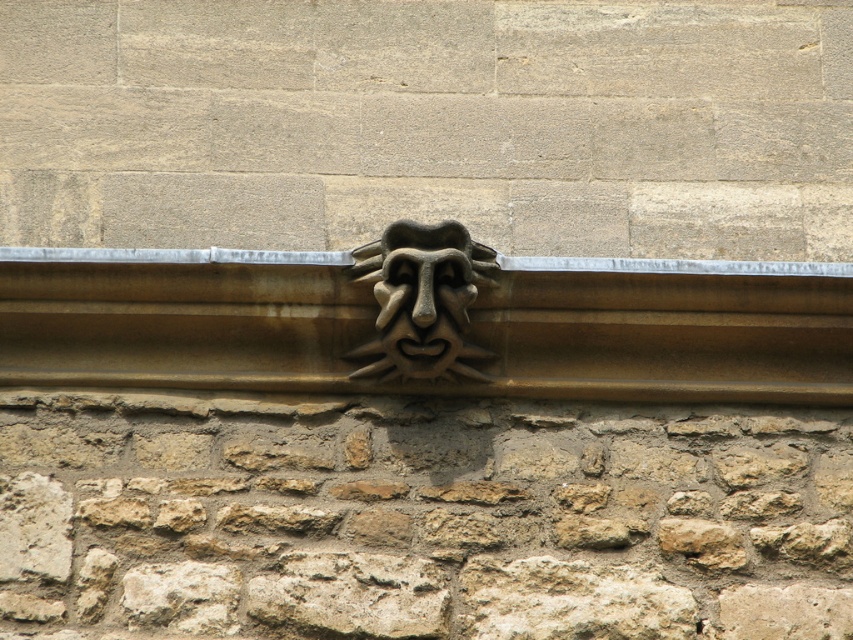
Which of these two, brown rough stone at center or brown stone ledge at center, stands taller?

With more height is brown rough stone at center.

Is brown rough stone at center bigger than brown stone ledge at center?

Correct, brown rough stone at center is larger in size than brown stone ledge at center.

Between point (685, 628) and point (664, 285), which one is positioned in front?

Positioned in front is point (685, 628).

The image size is (853, 640). Identify the location of brown rough stone at center. (421, 518).

Can you confirm if brown stone ledge at center is positioned to the left of brown stone mask at center?

In fact, brown stone ledge at center is to the right of brown stone mask at center.

I want to click on brown stone ledge at center, so point(427,326).

This screenshot has height=640, width=853. I want to click on brown stone ledge at center, so click(427, 326).

Locate an element on the screen. The width and height of the screenshot is (853, 640). brown stone ledge at center is located at coordinates (427, 326).

Is point (572, 413) positioned after point (399, 358)?

Yes.

Between point (219, 468) and point (480, 273), which one is positioned in front?

Point (219, 468) is more forward.

Between point (335, 512) and point (419, 234), which one is positioned in front?

Point (335, 512) is in front.

Find the location of a particular element. Image resolution: width=853 pixels, height=640 pixels. brown rough stone at center is located at coordinates (421, 518).